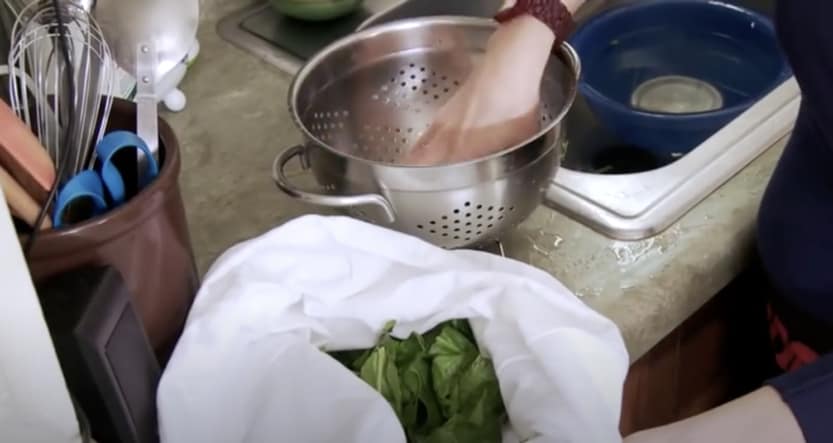
Locate an element on the screen. The width and height of the screenshot is (833, 443). blue bowl is located at coordinates (635, 53).